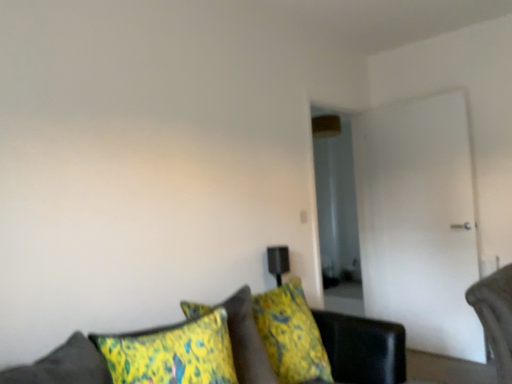
Question: Would you say velvet green couch at lower center is inside or outside yellow-green fabric pillow at lower center?

Choices:
 (A) outside
 (B) inside

Answer: (A)

Question: Looking at the image, does velvet green couch at lower center seem bigger or smaller compared to yellow-green fabric pillow at lower center?

Choices:
 (A) big
 (B) small

Answer: (A)

Question: Which object is the farthest from the velvet green couch at lower center?

Choices:
 (A) white glossy door at right
 (B) yellow-green fabric pillow at lower center

Answer: (A)

Question: Which object is the farthest from the white glossy door at right?

Choices:
 (A) yellow-green fabric pillow at lower center
 (B) velvet green couch at lower center

Answer: (A)